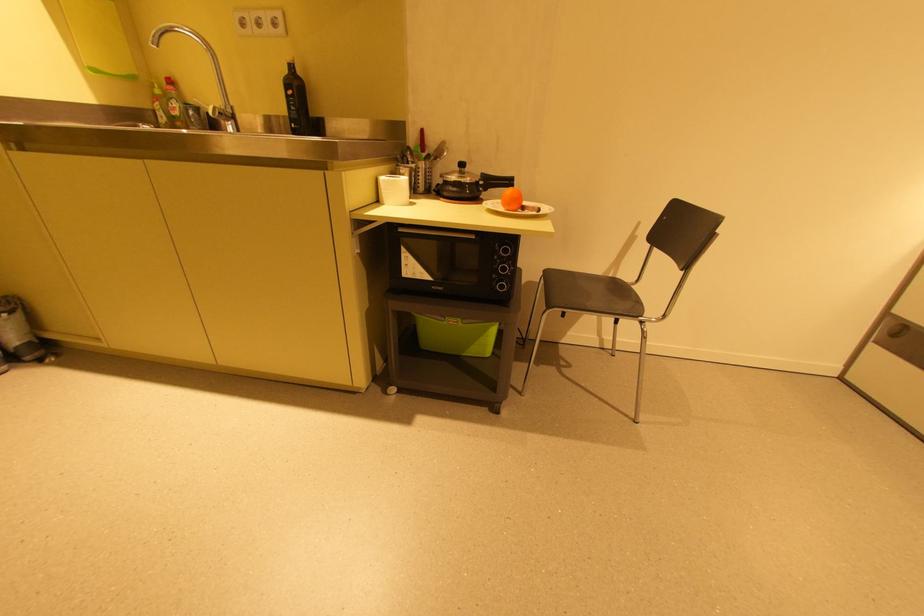
Locate an element on the screen. The image size is (924, 616). orange fruit is located at coordinates (512, 199).